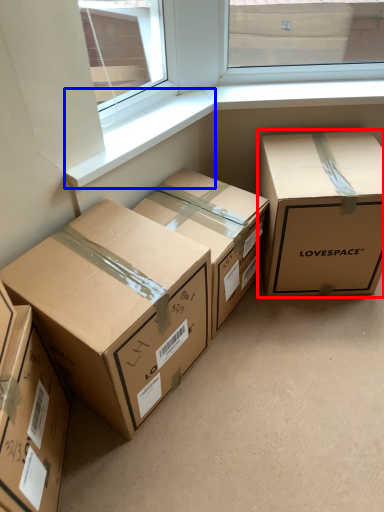
Question: Which point is further to the camera, box (highlighted by a red box) or window sill (highlighted by a blue box)?

Choices:
 (A) box
 (B) window sill

Answer: (A)